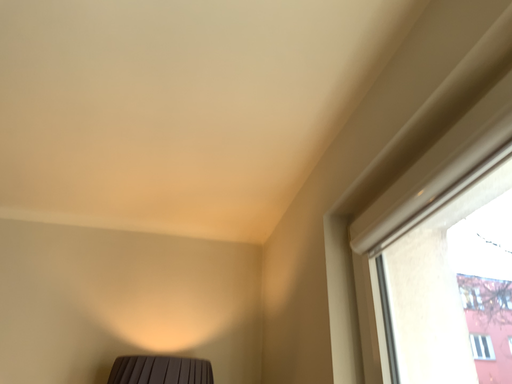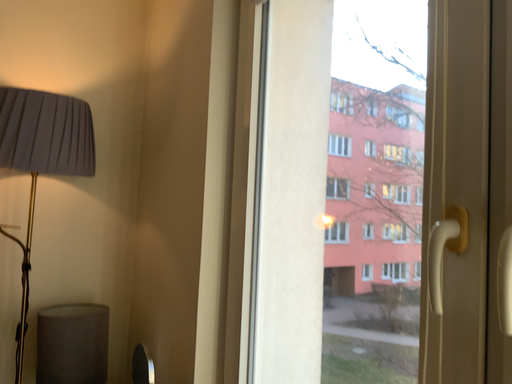
Question: How did the camera likely rotate when shooting the video?

Choices:
 (A) rotated left
 (B) rotated right

Answer: (B)